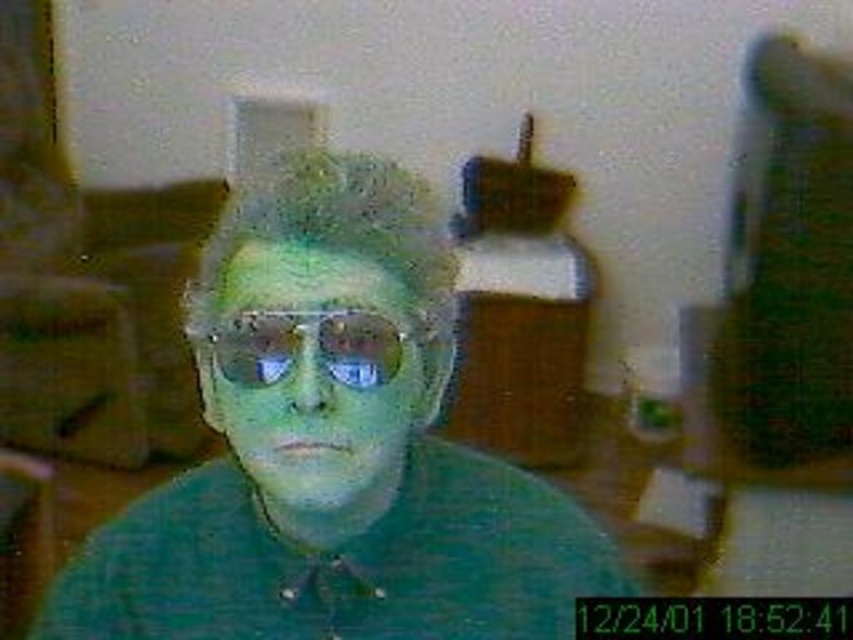
Between green matte face at center and metallic reflective sunglasses at center, which one appears on the left side from the viewer's perspective?

From the viewer's perspective, green matte face at center appears more on the left side.

Who is higher up, green matte face at center or metallic reflective sunglasses at center?

metallic reflective sunglasses at center

Where is `green matte face at center`? This screenshot has height=640, width=853. green matte face at center is located at coordinates (312, 372).

Which is behind, point (142, 557) or point (357, 449)?

Positioned behind is point (142, 557).

Is green matte shirt at center further to camera compared to green matte face at center?

Yes, green matte shirt at center is further from the viewer.

Is point (309, 490) closer to camera compared to point (256, 451)?

Yes, it is.

Locate an element on the screen. The image size is (853, 640). green matte shirt at center is located at coordinates (334, 451).

Which is more to the left, green matte shirt at center or metallic reflective sunglasses at center?

metallic reflective sunglasses at center

Does green matte shirt at center appear under metallic reflective sunglasses at center?

Yes, green matte shirt at center is below metallic reflective sunglasses at center.

Locate an element on the screen. This screenshot has height=640, width=853. green matte shirt at center is located at coordinates (334, 451).